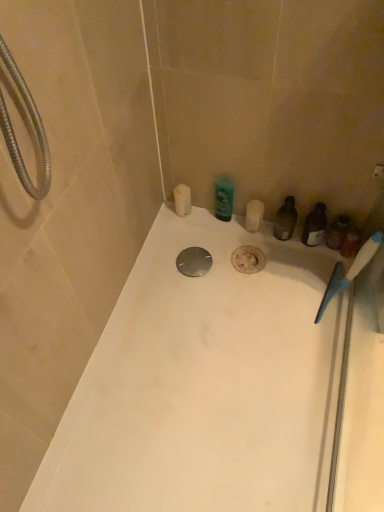
Where is `vacant area that lies between blue plastic toothbrush at right and translucent plastic container at right, which is the 1th toiletry from right to left`? vacant area that lies between blue plastic toothbrush at right and translucent plastic container at right, which is the 1th toiletry from right to left is located at coordinates (322, 281).